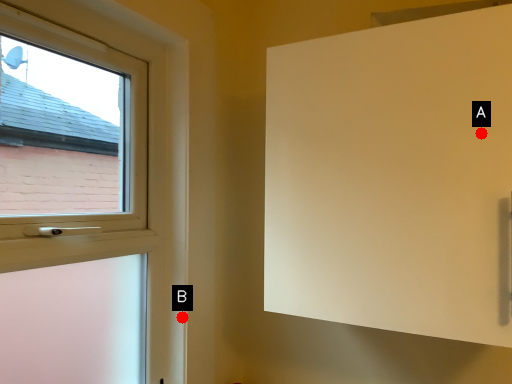
Question: Two points are circled on the image, labeled by A and B beside each circle. Which point is closer to the camera?

Choices:
 (A) A is closer
 (B) B is closer

Answer: (A)